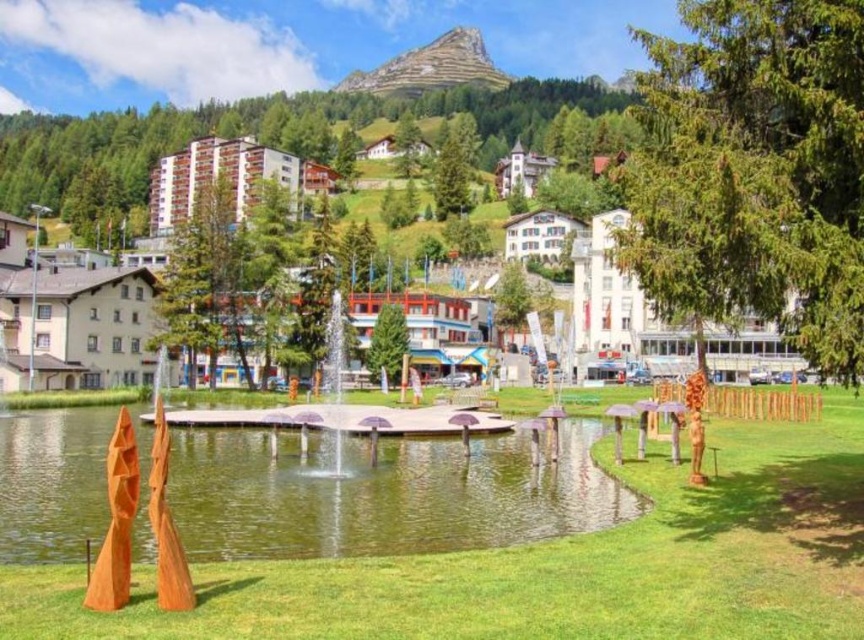
You are standing in the town square and notice the green grass at center and the green matte tree at upper center. Which object is closer to the ground?

The green grass at center is closer to the ground than the green matte tree at upper center because it is not as tall as the tree.

You are standing at the edge of the grassy area in the town scene and want to reach the water in the center. Given that you can walk 10 feet per minute, how many minutes will it take you to reach the green water at center from the green grass at center?

The green grass at center is 40.35 feet away from the green water at center. Since you walk at 10 feet per minute, it will take approximately 4.035 minutes to reach the green water at center.

Consider the image. You are standing at the entrance of the town and want to find the green grass at center. According to the coordinates provided, in which direction should you walk from your current position to reach it?

The green grass at center is located at coordinates point (557,564). Since these coordinates are relative to the image, moving towards the direction where the x and y values increase would lead you to the green grass at center.